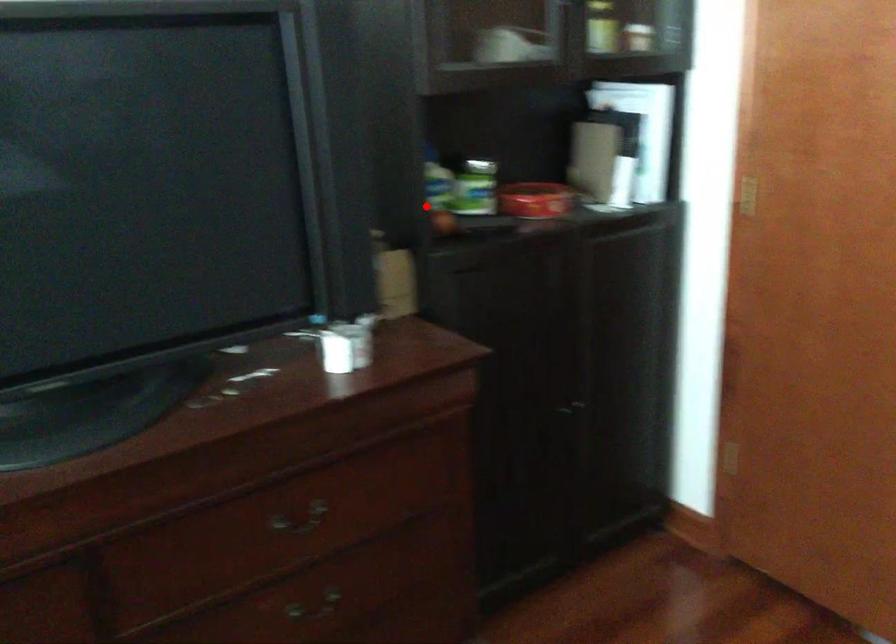
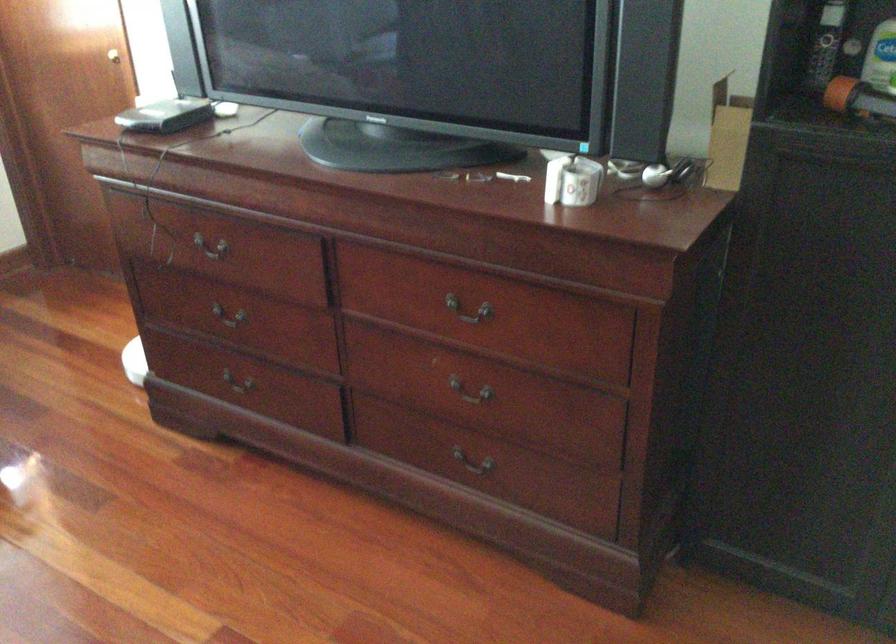
Question: I am providing you with two images of the same scene from different viewpoints. A red point is marked on the first image. At the location where the point appears in image 1, is it still visible in image 2?

Choices:
 (A) Yes
 (B) No

Answer: (A)